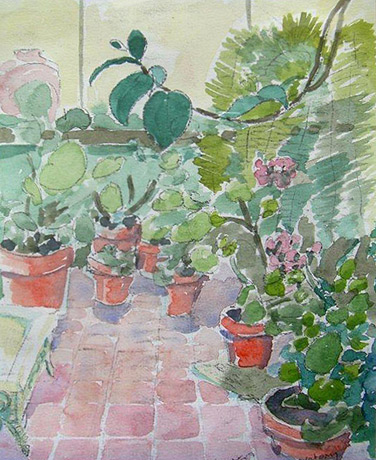
You are a GUI agent. You are given a task and a screenshot of the screen. Output one action in this format:
    pyautogui.click(x=<x>, y=<y>)
    Task: Click on the table
    Image resolution: width=376 pixels, height=460 pixels.
    Given the screenshot: What is the action you would take?
    pyautogui.click(x=14, y=376)